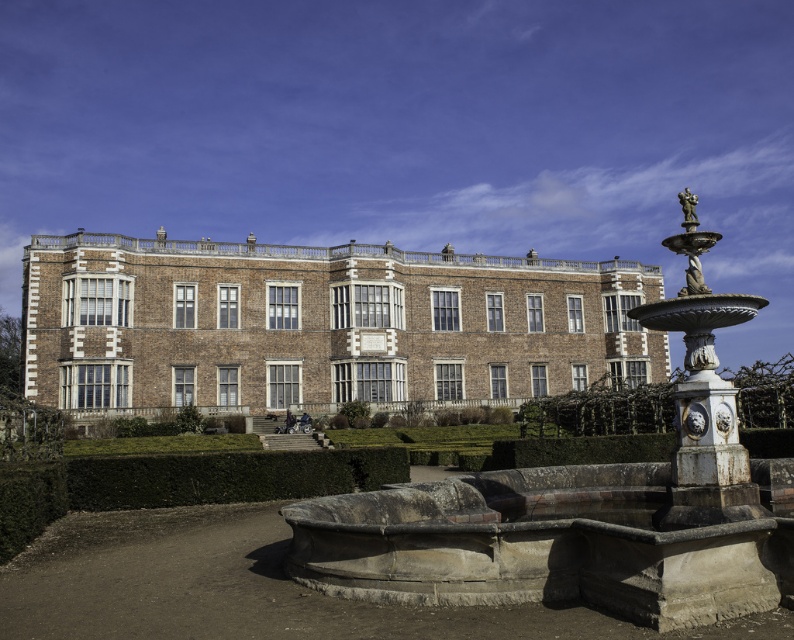
You are standing in front of the brown brick building at center and looking towards the bronze statue at upper right. Which object is higher in the image?

The bronze statue at upper right is higher in the image than the brown brick building at center because the brown brick building at center is located below it.

You are standing in front of the historic building and see two green leafy hedges. The first is the green leafy hedge at lower center, and the second is the green leafy hedge at center. From your perspective, which hedge is positioned to the left of the other?

The green leafy hedge at lower center is to the left of the green leafy hedge at center.